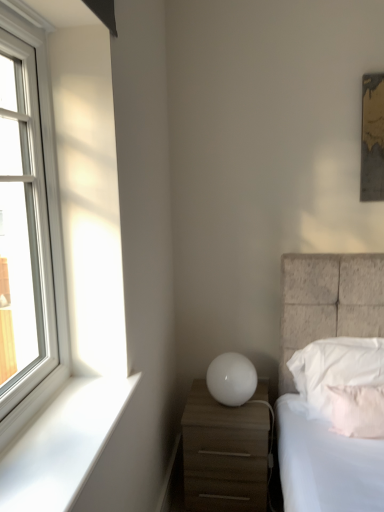
Find the location of a particular element. empty space that is ontop of white smooth window sill at lower left is located at coordinates (71, 423).